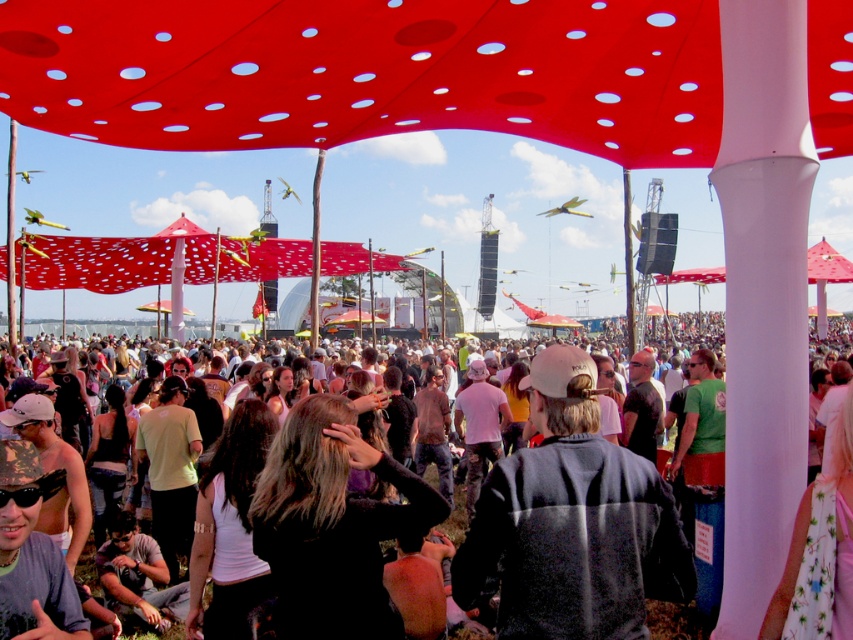
Question: Which object is the farthest from the black matte hair at center?

Choices:
 (A) black casual clothing at center
 (B) red perforated canopy at upper center
 (C) dark gray jacket at center

Answer: (B)

Question: Is red perforated canopy at upper center bigger than dark gray jacket at center?

Choices:
 (A) no
 (B) yes

Answer: (B)

Question: Which of the following is the farthest from the observer?

Choices:
 (A) (515, 605)
 (B) (639, 145)

Answer: (B)

Question: Which object is farther from the camera taking this photo?

Choices:
 (A) black matte hair at center
 (B) black casual clothing at center

Answer: (B)

Question: Does red perforated canopy at upper center appear on the left side of black matte hair at center?

Choices:
 (A) yes
 (B) no

Answer: (B)

Question: Does dark gray jacket at center appear under black casual clothing at center?

Choices:
 (A) no
 (B) yes

Answer: (B)